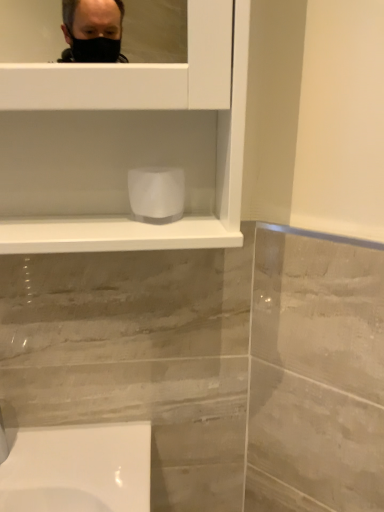
Question: In the image, is white matte toilet paper at center positioned in front of or behind matte silver faucet at lower left?

Choices:
 (A) front
 (B) behind

Answer: (B)

Question: From the image's perspective, is white matte toilet paper at center located above or below matte silver faucet at lower left?

Choices:
 (A) below
 (B) above

Answer: (B)

Question: From a real-world perspective, is white matte toilet paper at center above or below matte silver faucet at lower left?

Choices:
 (A) below
 (B) above

Answer: (B)

Question: Is matte silver faucet at lower left in front of or behind white matte toilet paper at center in the image?

Choices:
 (A) front
 (B) behind

Answer: (A)

Question: Considering the relative positions of matte silver faucet at lower left and white matte toilet paper at center in the image provided, is matte silver faucet at lower left to the left or to the right of white matte toilet paper at center?

Choices:
 (A) right
 (B) left

Answer: (B)

Question: From the image's perspective, is matte silver faucet at lower left positioned above or below white matte toilet paper at center?

Choices:
 (A) below
 (B) above

Answer: (A)

Question: Does point (x=1, y=445) appear closer or farther from the camera than point (x=137, y=173)?

Choices:
 (A) closer
 (B) farther

Answer: (B)